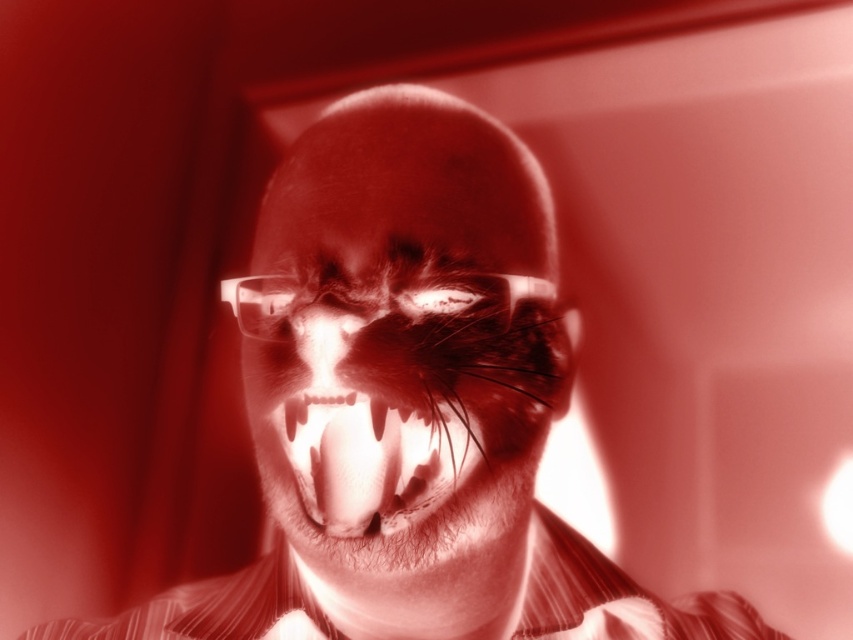
Question: Which point is farther to the camera?

Choices:
 (A) (477, 545)
 (B) (341, 323)
 (C) (323, 440)

Answer: (A)

Question: Among these objects, which one is farthest from the camera?

Choices:
 (A) translucent plastic face at center
 (B) translucent plastic mouth at center
 (C) striped cotton dress shirt at center
 (D) translucent glass nose at center

Answer: (C)

Question: Does translucent plastic face at center have a larger size compared to translucent glass nose at center?

Choices:
 (A) yes
 (B) no

Answer: (A)

Question: Is translucent plastic mouth at center to the left of translucent glass nose at center from the viewer's perspective?

Choices:
 (A) no
 (B) yes

Answer: (A)

Question: Can you confirm if striped cotton dress shirt at center is positioned below translucent plastic mouth at center?

Choices:
 (A) yes
 (B) no

Answer: (A)

Question: Based on their relative distances, which object is nearer to the translucent glass nose at center?

Choices:
 (A) translucent plastic face at center
 (B) translucent plastic mouth at center
 (C) striped cotton dress shirt at center

Answer: (B)